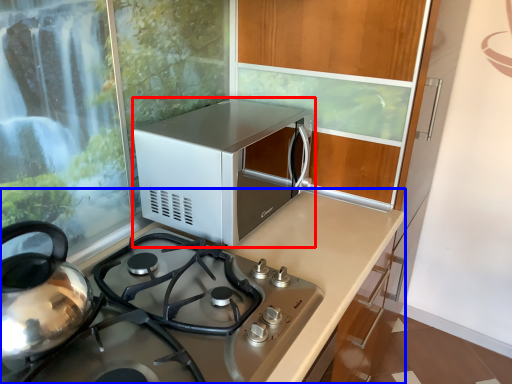
Question: Which object is closer to the camera taking this photo, microwave oven (highlighted by a red box) or countertop (highlighted by a blue box)?

Choices:
 (A) microwave oven
 (B) countertop

Answer: (B)